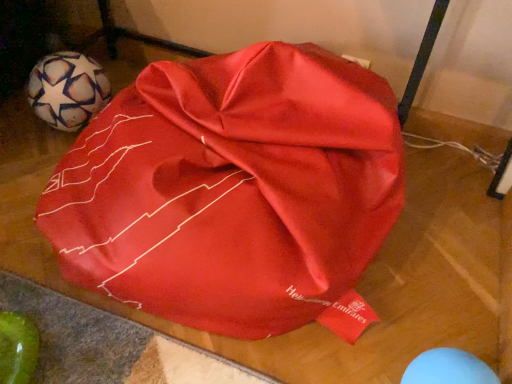
You are a GUI agent. You are given a task and a screenshot of the screen. Output one action in this format:
    pyautogui.click(x=<x>, y=<y>)
    Task: Click on the matte red bean bag at center
    
    Given the screenshot: What is the action you would take?
    pyautogui.click(x=234, y=191)

Describe the element at coordinates (234, 191) in the screenshot. I see `matte red bean bag at center` at that location.

Locate an element on the screen. The width and height of the screenshot is (512, 384). matte red bean bag at center is located at coordinates (234, 191).